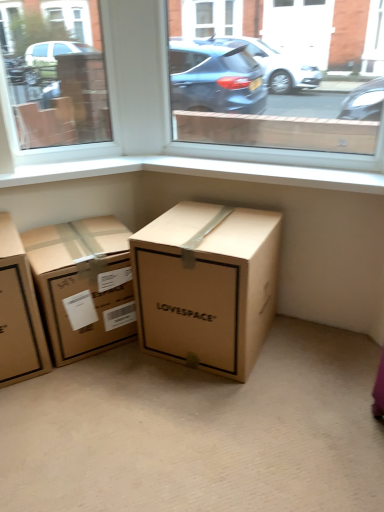
Question: Is point (86, 11) positioned closer to the camera than point (99, 284)?

Choices:
 (A) farther
 (B) closer

Answer: (A)

Question: Looking at their shapes, would you say transparent glass window at upper left, acting as the 1th window starting from the left, is wider or thinner than brown cardboard box at center, which is the 2th box in right-to-left order?

Choices:
 (A) thin
 (B) wide

Answer: (A)

Question: Considering the real-world distances, which object is closest to the brown cardboard box at center, which is the 2th box in right-to-left order?

Choices:
 (A) white smooth window sill at upper center
 (B) brown cardboard box at left, the first box viewed from the left
 (C) transparent glass window at center, the 1th window in the right-to-left sequence
 (D) brown cardboard box at center, the 3th box in the left-to-right sequence
 (E) transparent glass window at upper left, acting as the 1th window starting from the left

Answer: (B)

Question: Which object is the closest to the brown cardboard box at center, positioned as the second box in left-to-right order?

Choices:
 (A) white smooth window sill at upper center
 (B) brown cardboard box at left, the first box viewed from the left
 (C) transparent glass window at center, which is counted as the 2th window, starting from the left
 (D) transparent glass window at upper left, acting as the 1th window starting from the left
 (E) brown cardboard box at center, the 3th box in the left-to-right sequence

Answer: (B)